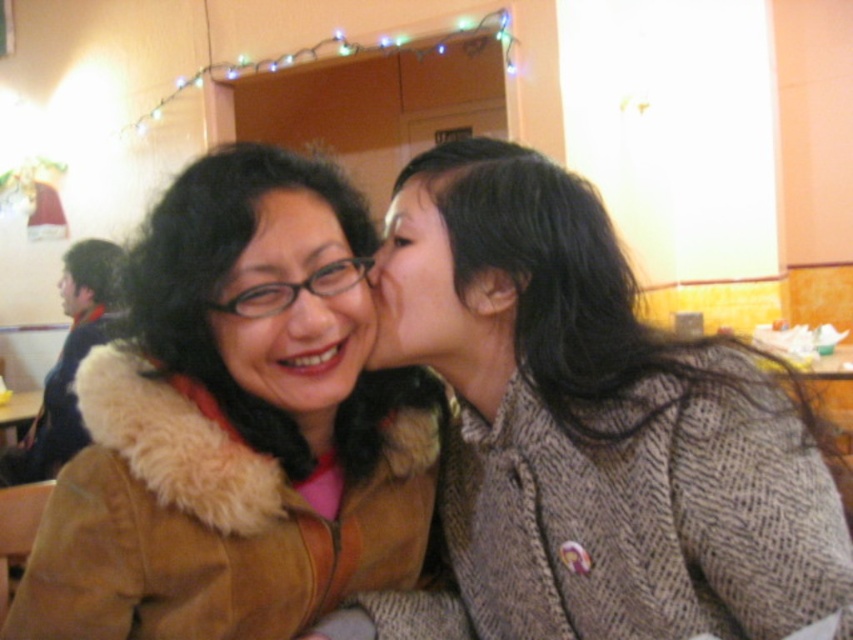
Is point (270, 232) closer to viewer compared to point (358, 326)?

That is True.

Does brown suede jacket at upper left appear on the right side of matte brown coat at center?

No, brown suede jacket at upper left is not to the right of matte brown coat at center.

Where is `brown suede jacket at upper left`? brown suede jacket at upper left is located at coordinates (236, 424).

Between matte brown coat at center and matte black hair at center, which one is positioned lower?

matte brown coat at center is lower down.

Which is in front, point (251, 374) or point (380, 253)?

Point (251, 374) is more forward.

Who is more forward, (343, 365) or (433, 337)?

Point (343, 365) is in front.

Locate an element on the screen. Image resolution: width=853 pixels, height=640 pixels. matte brown coat at center is located at coordinates (294, 308).

Between brown suede jacket at upper left and matte black face at upper left, which one has less height?

With less height is matte black face at upper left.

Which is above, brown suede jacket at upper left or matte black face at upper left?

matte black face at upper left is higher up.

Between point (326, 205) and point (80, 298), which one is positioned behind?

Point (80, 298)

Identify the location of brown suede jacket at upper left. This screenshot has width=853, height=640. (236, 424).